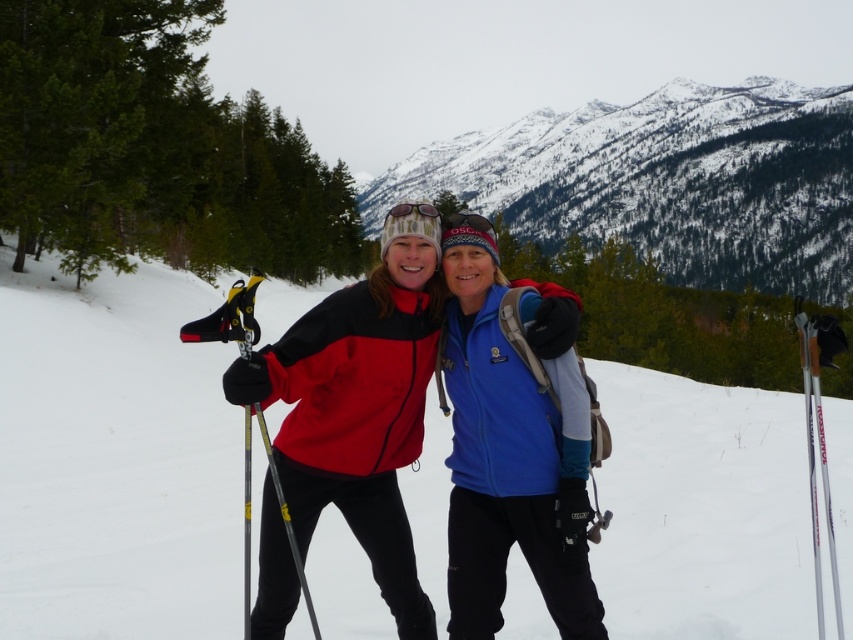
Can you confirm if snowy mountain at center is shorter than silver metallic ski at right?

No, snowy mountain at center is not shorter than silver metallic ski at right.

Can you confirm if snowy mountain at center is thinner than silver metallic ski at right?

No, snowy mountain at center is not thinner than silver metallic ski at right.

Which is in front, point (682, 176) or point (825, 326)?

Point (825, 326) is in front.

I want to click on snowy mountain at center, so click(x=666, y=180).

Does snowy mountain at center appear under translucent plastic goggles at center?

Incorrect, snowy mountain at center is not positioned below translucent plastic goggles at center.

Does snowy mountain at center appear on the left side of translucent plastic goggles at center?

Incorrect, snowy mountain at center is not on the left side of translucent plastic goggles at center.

Describe the element at coordinates (666, 180) in the screenshot. I see `snowy mountain at center` at that location.

This screenshot has width=853, height=640. Identify the location of snowy mountain at center. (666, 180).

Is matte nylon jacket at center above translucent plastic goggles at center?

No.

Which is below, matte nylon jacket at center or translucent plastic goggles at center?

matte nylon jacket at center is below.

Describe the element at coordinates (358, 404) in the screenshot. I see `matte nylon jacket at center` at that location.

At what (x,y) coordinates should I click in order to perform the action: click on matte nylon jacket at center. Please return your answer as a coordinate pair (x, y). This screenshot has height=640, width=853. Looking at the image, I should click on (358, 404).